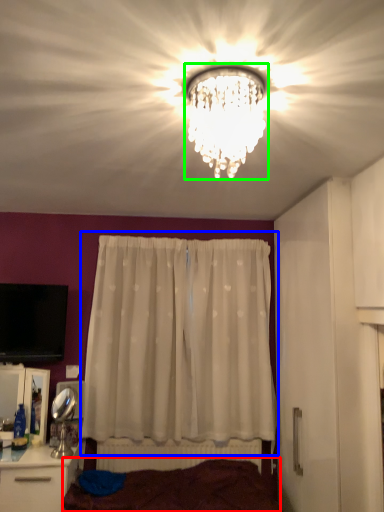
Question: Considering the real-world distances, which object is closest to bed frame (highlighted by a red box)? curtain (highlighted by a blue box) or lamp (highlighted by a green box).

Choices:
 (A) curtain
 (B) lamp

Answer: (A)